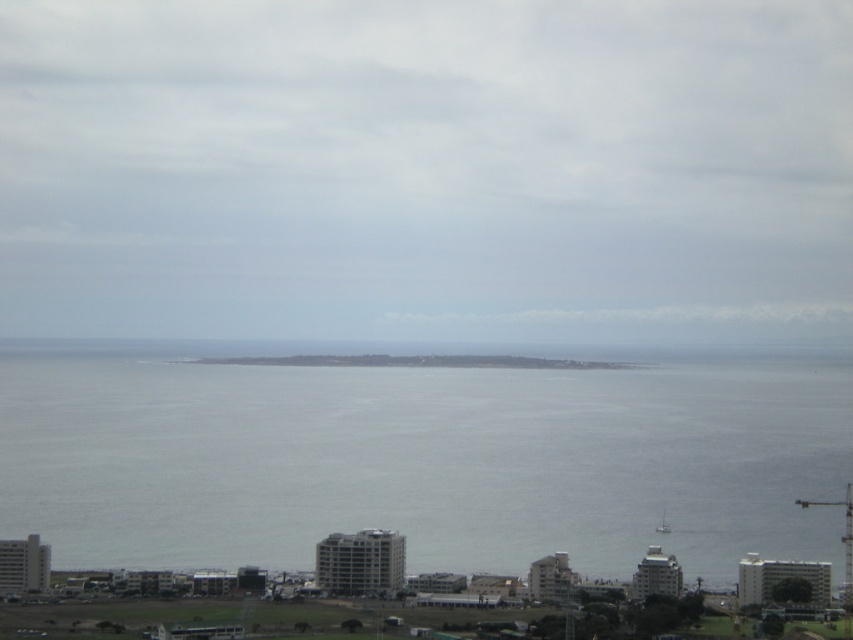
Is the position of gray water at center more distant than that of gray concrete coast at center?

No.

Does gray water at center come in front of gray concrete coast at center?

Yes, gray water at center is closer to the viewer.

Does point (799, 413) come farther from viewer compared to point (396, 358)?

Yes, point (799, 413) is behind point (396, 358).

Identify the location of gray water at center. (421, 460).